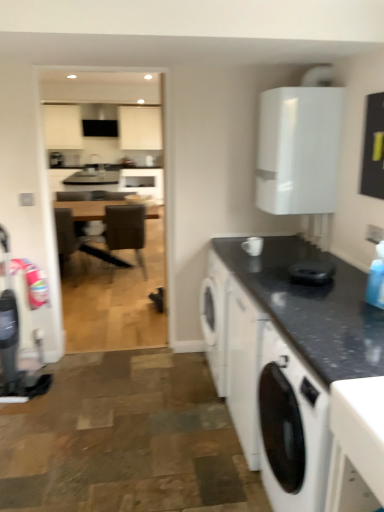
Where is `vacant area that is in front of brown leather chair at center`? This screenshot has height=512, width=384. vacant area that is in front of brown leather chair at center is located at coordinates (107, 290).